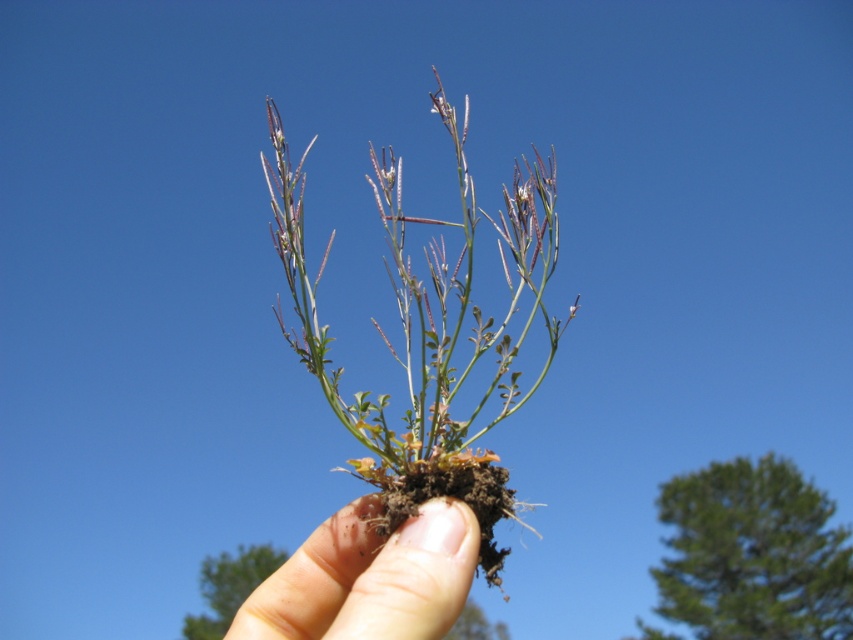
Can you confirm if green leafy plant at center is positioned above smooth skin hand at center?

Yes.

Is point (405, 296) farther from viewer compared to point (434, 529)?

That is True.

Is point (463, 429) in front of point (438, 620)?

No, it is behind (438, 620).

Locate an element on the screen. The height and width of the screenshot is (640, 853). green leafy plant at center is located at coordinates (430, 330).